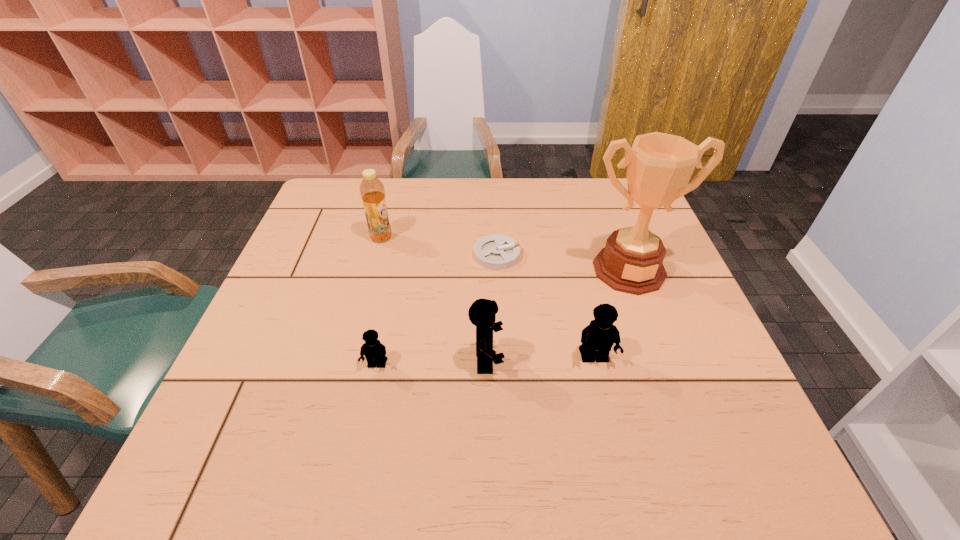
Find the location of `the leftmost Lego`. the leftmost Lego is located at coordinates (374, 351).

Identify the location of the fifth object from right to left. The width and height of the screenshot is (960, 540). point(374,351).

At what (x,y) coordinates should I click in order to perform the action: click on the second Lego from left to right. Please return your answer as a coordinate pair (x, y). Image resolution: width=960 pixels, height=540 pixels. Looking at the image, I should click on (482, 313).

I want to click on the rightmost Lego, so click(x=597, y=339).

Where is `the third shortest object`? the third shortest object is located at coordinates (x=597, y=339).

In order to click on the second tallest object in this screenshot , I will do `click(372, 191)`.

Where is `the leftmost object`? The width and height of the screenshot is (960, 540). the leftmost object is located at coordinates (372, 191).

At what (x,y) coordinates should I click in order to perform the action: click on the tallest object. Please return your answer as a coordinate pair (x, y). Looking at the image, I should click on (660, 165).

Image resolution: width=960 pixels, height=540 pixels. Find the location of `ashtray`. ashtray is located at coordinates (495, 252).

Where is `blank area located 0.080m on the front-facing side of the fifth tallest object`? The width and height of the screenshot is (960, 540). blank area located 0.080m on the front-facing side of the fifth tallest object is located at coordinates (368, 408).